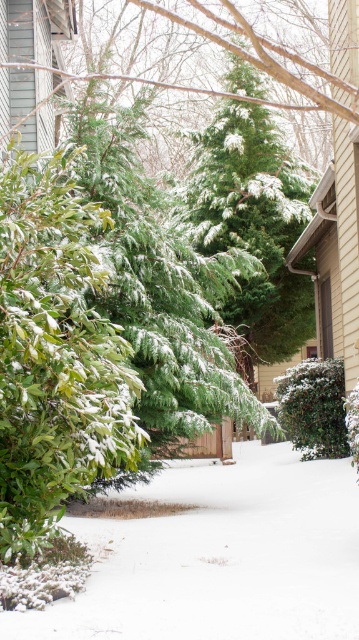
You are a delivery robot that is 2 meters wide. You need to move from the left side of the image to the right side. Can you pass between the white fluffy snow at center and the green matte bush at center without getting stuck?

The white fluffy snow at center and green matte bush at center are 2.19 meters apart from each other. Since the robot is 2 meters wide, it can pass through the space between them as the distance is slightly larger than the robot.

From the picture: You are standing in the winter scene and want to place a small snowman exactly at the center of the image. Is the white fluffy snow at center already positioned where you want to build the snowman?

The white fluffy snow at center is located at point (220, 556), which is not the exact center of the image. Therefore, you would need to adjust the position to build the snowman at the true center.

What object is located at the coordinates point (56, 353) in the winter scene?

The point (56, 353) marks the green matte bush at center left.